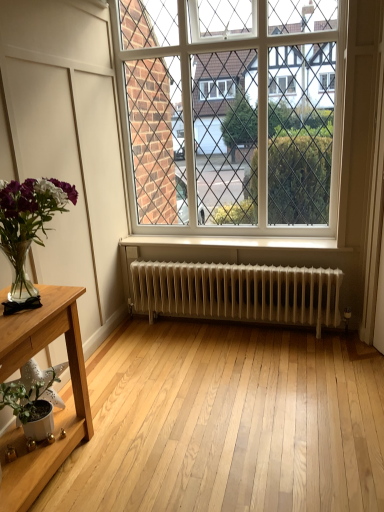
The height and width of the screenshot is (512, 384). What are the coordinates of `free spot to the right of light wood table at lower left` in the screenshot? It's located at pos(135,462).